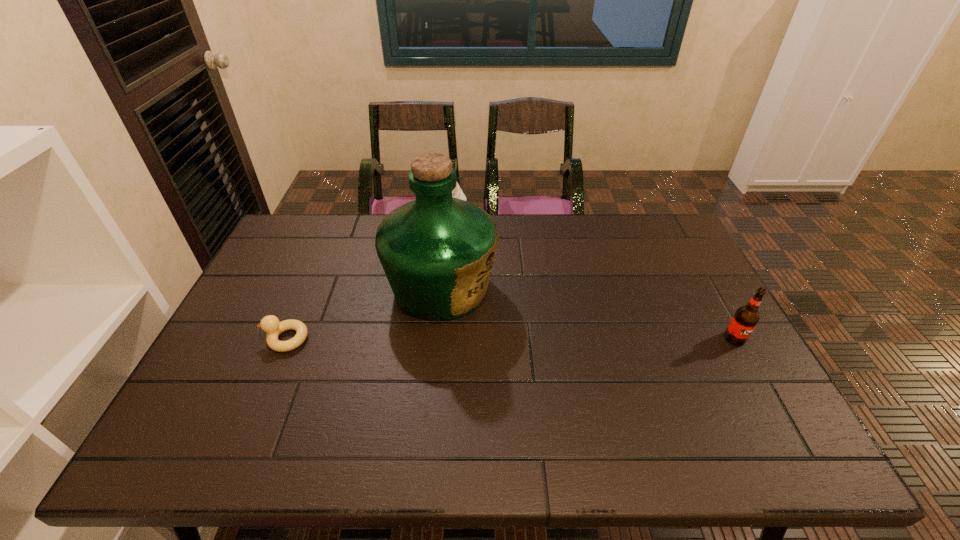
Locate an element on the screen. The image size is (960, 540). free space on the desktop that is between the shortest object and the root beer and is positioned on the front-facing side of the farthest object is located at coordinates (471, 339).

Identify the location of vacant space on the desktop that is between the duckling and the root beer and is positioned on the label side of the liquor. (544, 339).